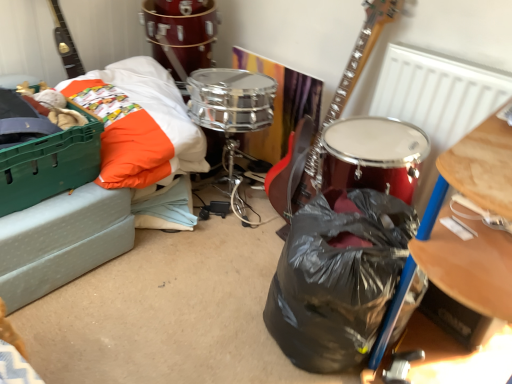
Question: From a real-world perspective, is shiny metallic drum at upper center below black plastic bag at center?

Choices:
 (A) no
 (B) yes

Answer: (A)

Question: Does shiny metallic drum at upper center lie behind black plastic bag at center?

Choices:
 (A) yes
 (B) no

Answer: (A)

Question: Considering the relative positions of shiny metallic drum at upper center and black plastic bag at center in the image provided, is shiny metallic drum at upper center to the left of black plastic bag at center from the viewer's perspective?

Choices:
 (A) yes
 (B) no

Answer: (A)

Question: Is black plastic bag at center at the back of shiny metallic drum at upper center?

Choices:
 (A) yes
 (B) no

Answer: (B)

Question: Would you say shiny metallic drum at upper center contains black plastic bag at center?

Choices:
 (A) yes
 (B) no

Answer: (B)

Question: In terms of height, does green plastic crate at left look taller or shorter compared to shiny metallic drum at upper center?

Choices:
 (A) short
 (B) tall

Answer: (B)

Question: From the image's perspective, is green plastic crate at left located above or below shiny metallic drum at upper center?

Choices:
 (A) above
 (B) below

Answer: (B)

Question: In the image, is green plastic crate at left positioned in front of or behind shiny metallic drum at upper center?

Choices:
 (A) behind
 (B) front

Answer: (B)

Question: In the image, is green plastic crate at left on the left side or the right side of shiny metallic drum at upper center?

Choices:
 (A) left
 (B) right

Answer: (A)

Question: From the image's perspective, is black plastic bag at center above or below shiny metallic drum at upper center?

Choices:
 (A) above
 (B) below

Answer: (B)

Question: Is black plastic bag at center situated inside shiny metallic drum at upper center or outside?

Choices:
 (A) outside
 (B) inside

Answer: (A)

Question: Relative to shiny metallic drum at upper center, is black plastic bag at center in front or behind?

Choices:
 (A) front
 (B) behind

Answer: (A)

Question: Considering the positions of black plastic bag at center and shiny metallic drum at upper center in the image, is black plastic bag at center bigger or smaller than shiny metallic drum at upper center?

Choices:
 (A) big
 (B) small

Answer: (B)

Question: Is shiny metallic drum at upper center in front of or behind black plastic bag at center in the image?

Choices:
 (A) front
 (B) behind

Answer: (B)

Question: Visually, is shiny metallic drum at upper center positioned to the left or to the right of black plastic bag at center?

Choices:
 (A) right
 (B) left

Answer: (B)